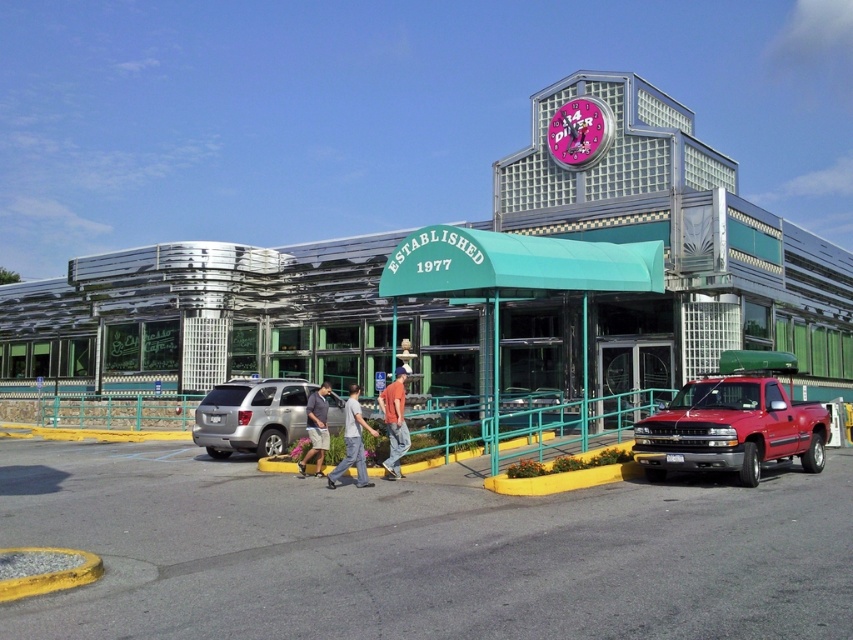
Question: Estimate the real-world distances between objects in this image. Which object is farther from the silver metallic suv at center?

Choices:
 (A) metallic red truck at lower right
 (B) orange shirt at center

Answer: (A)

Question: Is asphalt at lower center to the left of orange shirt at center from the viewer's perspective?

Choices:
 (A) yes
 (B) no

Answer: (B)

Question: From the image, what is the correct spatial relationship of metallic red truck at lower right in relation to gray cotton pants at center?

Choices:
 (A) left
 (B) right

Answer: (B)

Question: From the image, what is the correct spatial relationship of asphalt at lower center in relation to orange shirt at center?

Choices:
 (A) left
 (B) right

Answer: (B)

Question: Estimate the real-world distances between objects in this image. Which object is farther from the asphalt at lower center?

Choices:
 (A) metallic red truck at lower right
 (B) silver metallic suv at center
 (C) gray cotton pants at center
 (D) metallic glass building at center

Answer: (D)

Question: Which point is farther from the camera taking this photo?

Choices:
 (A) (697, 412)
 (B) (674, 100)
 (C) (341, 628)
 (D) (387, 422)

Answer: (B)